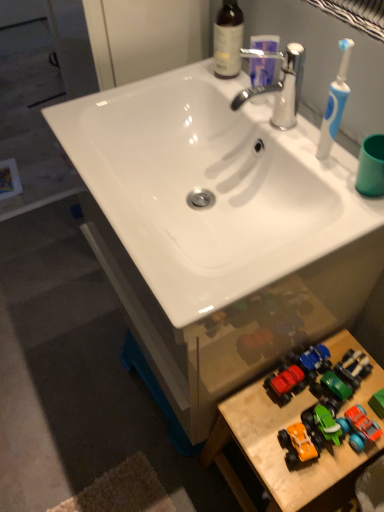
The image size is (384, 512). I want to click on vacant area that is situated to the right of chrome metallic faucet at upper center, so click(315, 134).